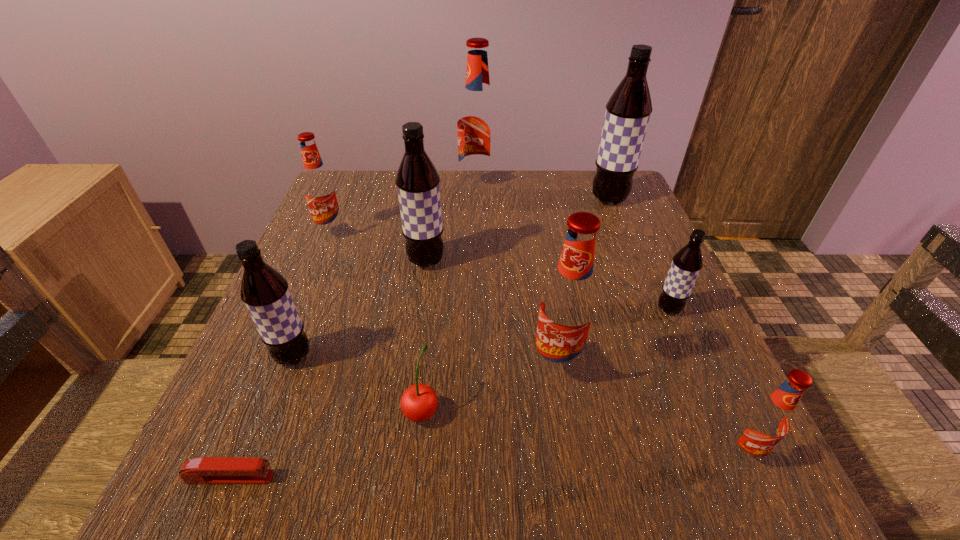
Identify the location of stapler at the near edge. The height and width of the screenshot is (540, 960). (205, 470).

At what (x,y) coordinates should I click in order to perform the action: click on stapler positioned at the left edge. Please return your answer as a coordinate pair (x, y). Looking at the image, I should click on (205, 470).

Image resolution: width=960 pixels, height=540 pixels. Find the location of `object located in the near left corner section of the desktop`. object located in the near left corner section of the desktop is located at coordinates (205, 470).

Identify the location of object situated at the far right corner. (628, 110).

I want to click on object present at the near right corner, so click(766, 422).

Locate an element on the screen. The image size is (960, 540). free space at the far edge of the desktop is located at coordinates (479, 211).

In the image, there is a desktop. Where is `vacant space at the near edge`? vacant space at the near edge is located at coordinates (491, 489).

Identify the location of vacant region at the left edge. This screenshot has height=540, width=960. (346, 269).

In the image, there is a desktop. Where is `vacant space at the right edge`? vacant space at the right edge is located at coordinates (730, 390).

The image size is (960, 540). What are the coordinates of `vacant region at the near left corner` in the screenshot? It's located at pos(264,491).